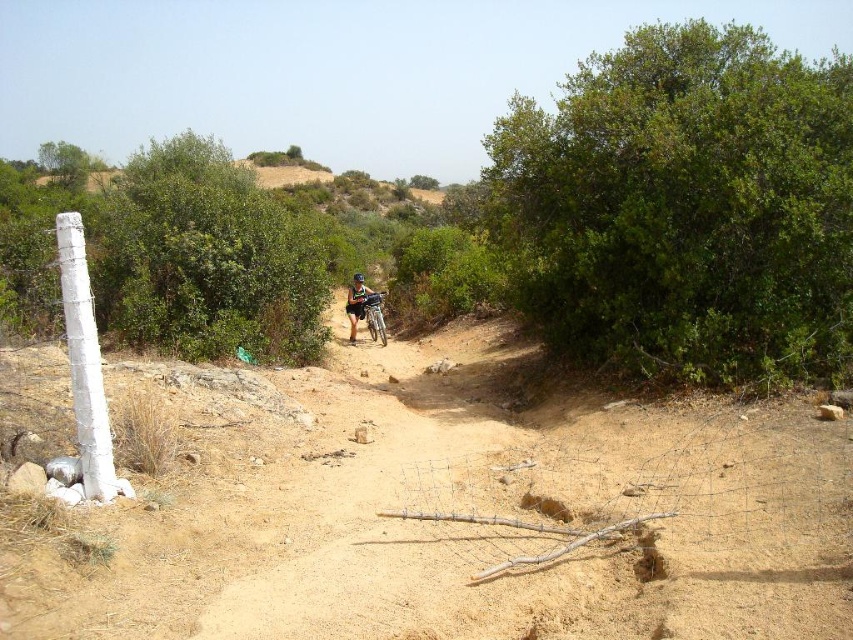
You are a mountain biker navigating the trail and want to reach the point closer to you. Which point should you head towards, point (373, 339) or point (360, 284)?

Point (373, 339) is further to the viewer than point (360, 284), so you should head towards point (360, 284) since it is closer to you.

You are a hiker planning to take a photo of the silver metallic mountain bike at center and the green fabric shirt at center. Which object should you focus on first if you want to capture both in a single frame without moving the camera?

The silver metallic mountain bike at center is smaller than the green fabric shirt at center, so you should focus on the green fabric shirt at center first to ensure it fits within the frame.